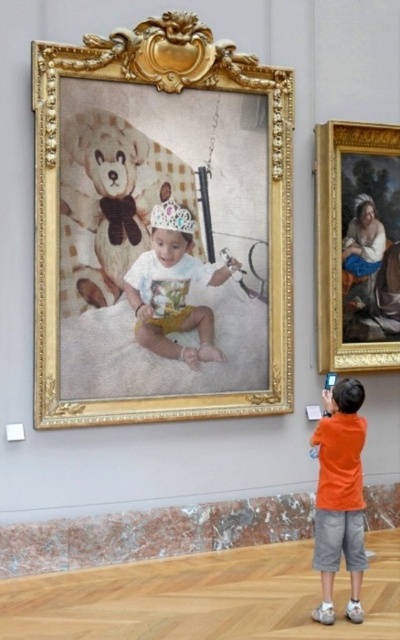
You are an art curator planning to install a new exhibit. You have two items to place in the gallery space. The goldmetallicpicture frame at right and the orange cotton shirt at lower right. According to the image, which item is positioned higher in the scene?

The goldmetallicpicture frame at right is positioned higher than the orange cotton shirt at lower right in the scene.

Consider the image. You are an art curator planning to display the goldmetallicpicture frame at right and the orange cotton shirt at lower right in a new exhibition. Given their sizes, which object should be placed in a more prominent position to ensure they are both visible to visitors?

The goldmetallicpicture frame at right should be placed in a more prominent position because it has a larger size compared to the orange cotton shirt at lower right, making it more noticeable and suitable for a central display.